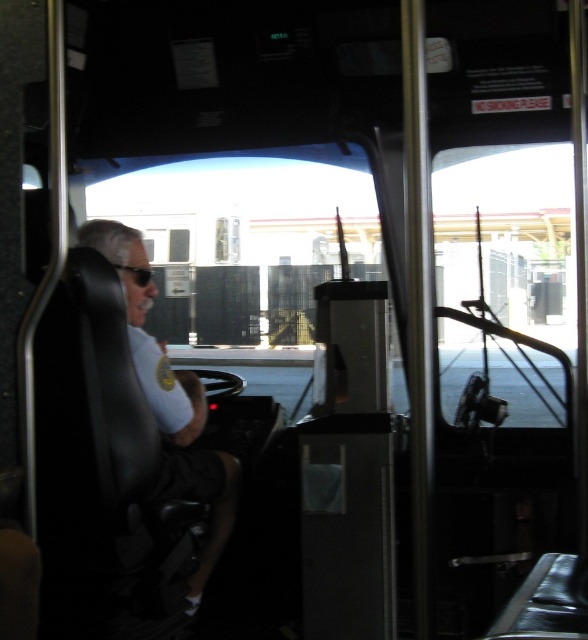
You are a passenger on the bus and need to determine which item takes up more horizontal space between the matte black shirt at left and the black rubber goggles at upper left. Which one is wider?

The matte black shirt at left is wider than the black rubber goggles at upper left according to the description.

You are a passenger on the bus and want to hand a note to the driver without leaving your seat. The note is in your pocket, and you need to reach towards the driver. Considering the space between the matte black shirt at left and the black rubber goggles at upper left, can you estimate if your 12 inch long arm reach can comfortably extend to the driver?

The distance between the matte black shirt at left and the black rubber goggles at upper left is 16.82 inches. Since your arm reach is 12 inches, it may be a bit challenging to comfortably extend that far, but it might be possible with stretching.

You are a passenger on the bus and need to identify which object is bigger between the matte black shirt at left and the black rubber goggles at upper left. Which one is larger?

The matte black shirt at left is larger in size than the black rubber goggles at upper left.